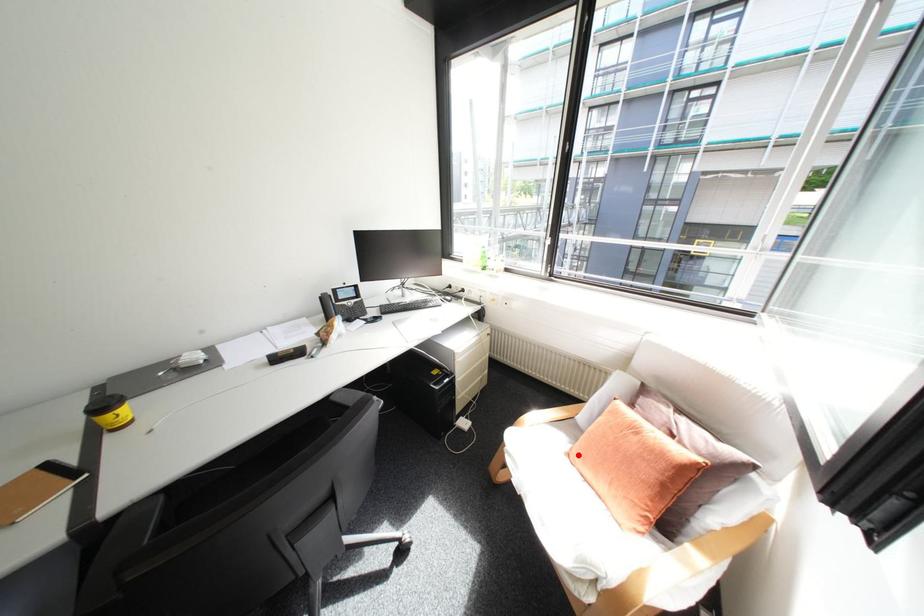
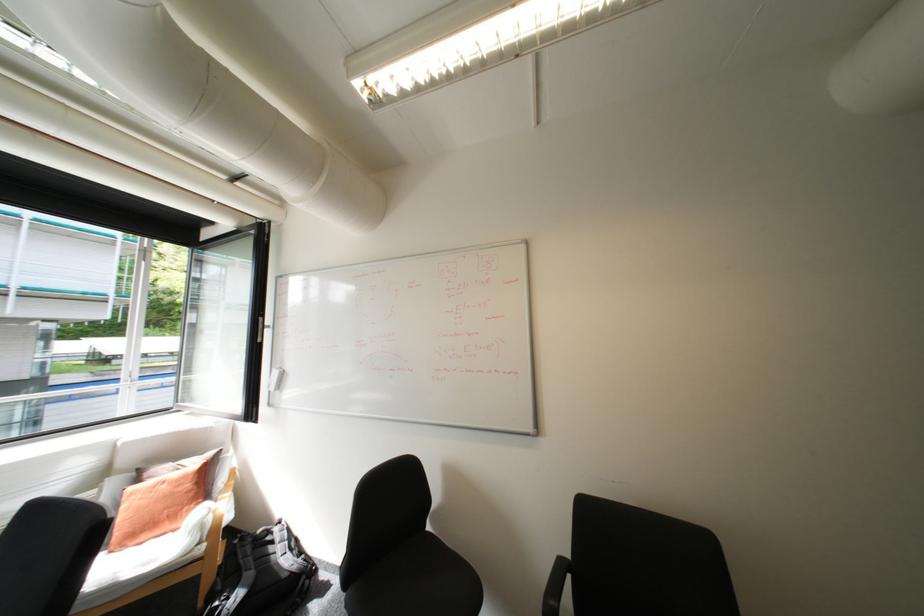
Locate, in the second image, the point that corresponds to the highlighted location in the first image.

(122, 552)